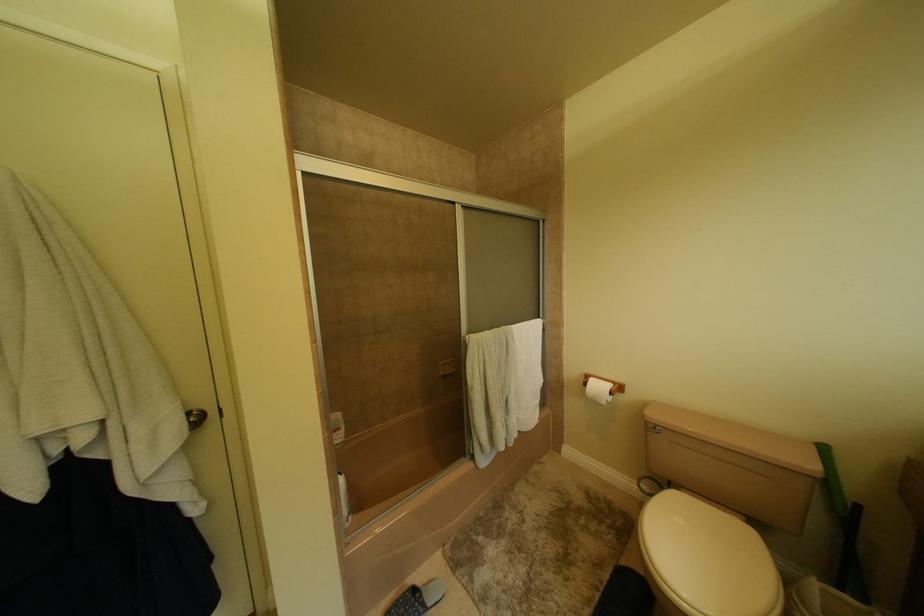
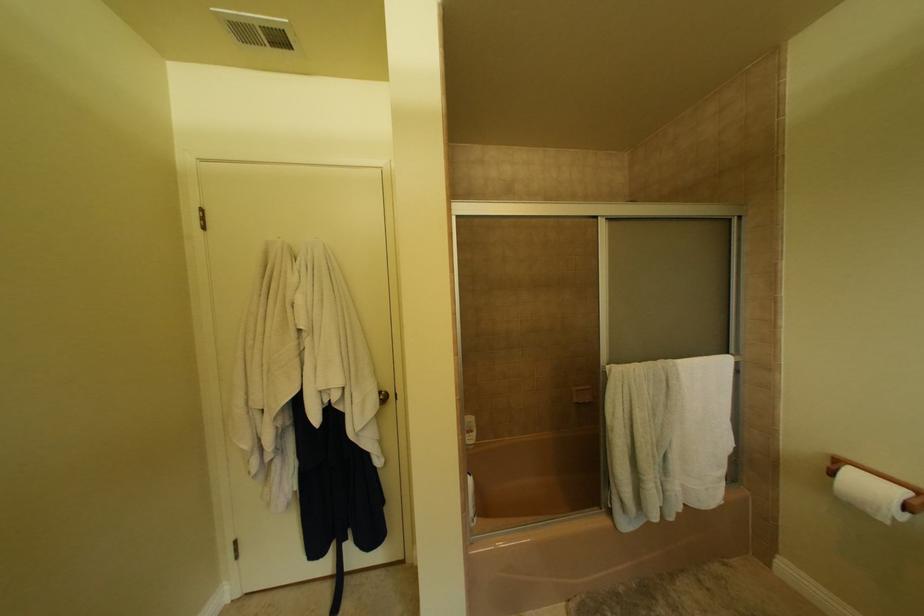
Question: The images are taken continuously from a first-person perspective. In which direction is your viewpoint rotating?

Choices:
 (A) Left
 (B) Right
 (C) Up
 (D) Down

Answer: (A)